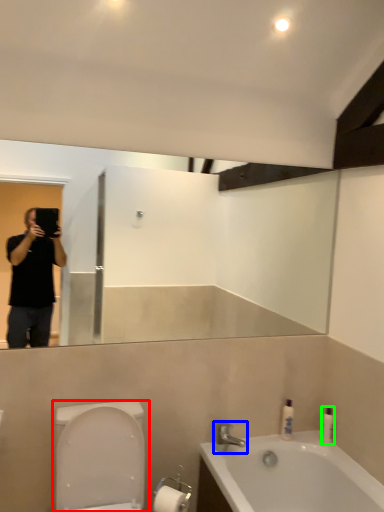
Question: Considering the real-world distances, which object is closest to toilet (highlighted by a red box)? tap (highlighted by a blue box) or toiletry (highlighted by a green box).

Choices:
 (A) tap
 (B) toiletry

Answer: (A)